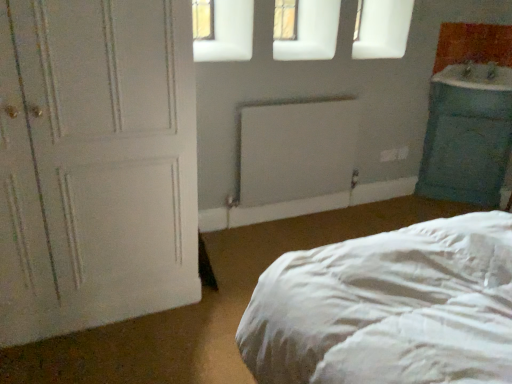
The width and height of the screenshot is (512, 384). I want to click on blank space situated above white matte radiator at center (from a real-world perspective), so click(307, 96).